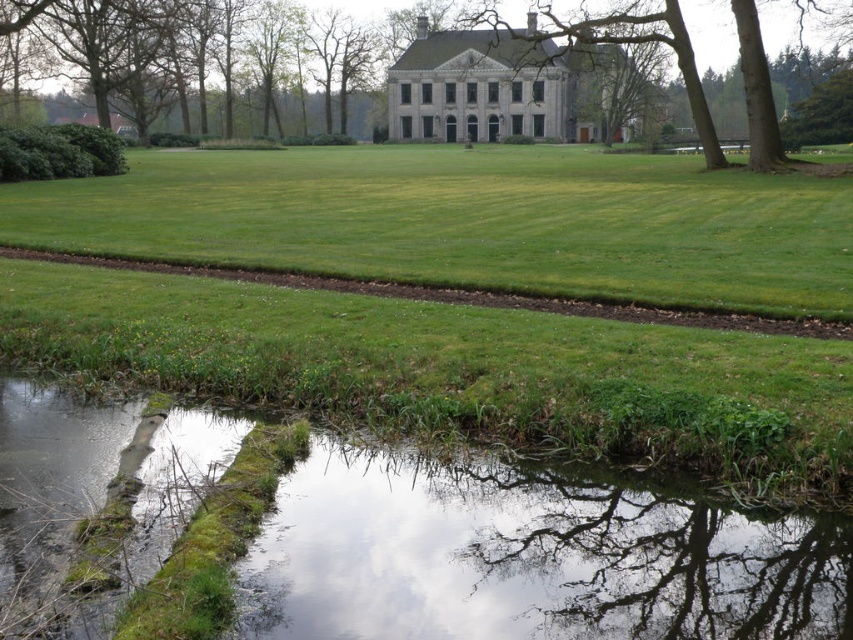
Measure the distance between green grass at lower center and camera.

green grass at lower center is 12.61 meters away from camera.

Who is positioned more to the right, green grass at lower center or brown textured tree at center?

Positioned to the right is brown textured tree at center.

Between point (224, 220) and point (610, 22), which one is positioned behind?

Point (610, 22)

The width and height of the screenshot is (853, 640). I want to click on green grass at lower center, so click(469, 220).